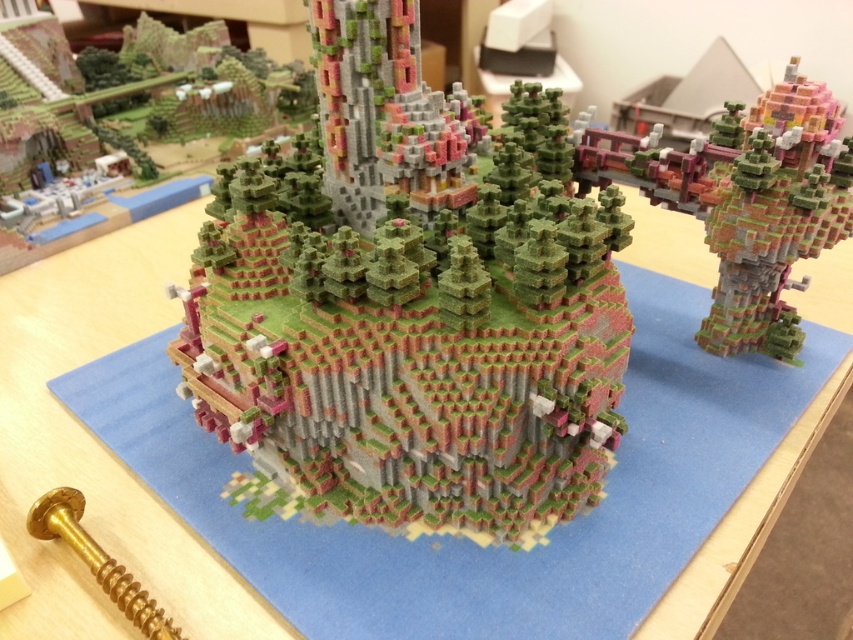
You are a character in the Minecraft world and need to determine which point is closer to you. You see two points marked in the scene. The first is at point [584,452] and the second is at point [146,593]. Which point is closer to your current position?

Point [584,452] is closer to you because it is further to the viewer than point [146,593].

You are an architect examining the Minecraft model on the blue rectangular base. You need to place a new decorative element between the pixelated green tower at center and the gold metallic screw at lower left. Which object should you place the new element closer to?

The new decorative element should be placed closer to the gold metallic screw at lower left because the pixelated green tower at center is positioned on the right side of the gold metallic screw at lower left, meaning the screw is to the left of the tower.